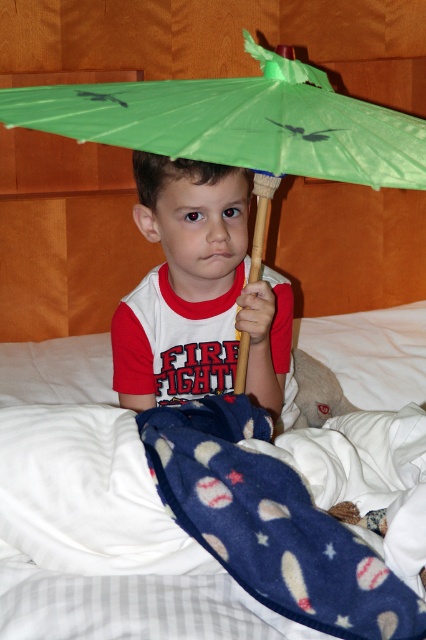
Between green paper umbrella at center and matte green umbrella at center, which one appears on the left side from the viewer's perspective?

From the viewer's perspective, green paper umbrella at center appears more on the left side.

Image resolution: width=426 pixels, height=640 pixels. Describe the element at coordinates (65, 236) in the screenshot. I see `green paper umbrella at center` at that location.

Find the location of `green paper umbrella at center`. green paper umbrella at center is located at coordinates (65, 236).

Is the position of white fleece blanket at center more distant than that of matte green umbrella at center?

No, white fleece blanket at center is closer to the viewer.

The height and width of the screenshot is (640, 426). What do you see at coordinates (98, 516) in the screenshot? I see `white fleece blanket at center` at bounding box center [98, 516].

You are a GUI agent. You are given a task and a screenshot of the screen. Output one action in this format:
    pyautogui.click(x=<x>, y=<y>)
    Task: Click on the white fleece blanket at center
    The width and height of the screenshot is (426, 640).
    Given the screenshot: What is the action you would take?
    pyautogui.click(x=98, y=516)

Between white fleece blanket at center and green paper umbrella at center, which one appears on the left side from the viewer's perspective?

Positioned to the left is green paper umbrella at center.

Can you confirm if white fleece blanket at center is taller than green paper umbrella at center?

No, white fleece blanket at center is not taller than green paper umbrella at center.

Is point (45, 548) closer to camera compared to point (34, 160)?

That is True.

This screenshot has height=640, width=426. Find the location of `white fleece blanket at center`. white fleece blanket at center is located at coordinates pyautogui.click(x=98, y=516).